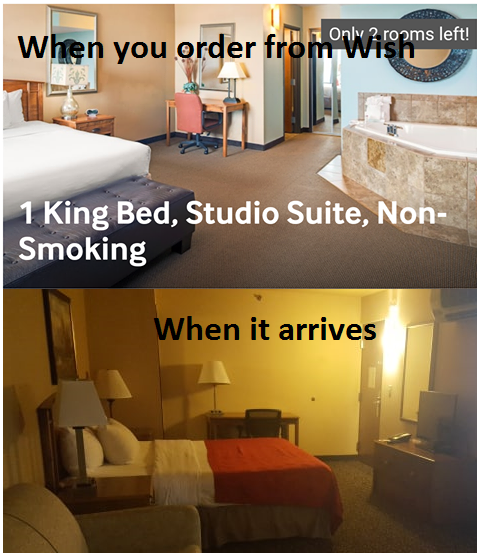
Where is `bed`? Image resolution: width=477 pixels, height=553 pixels. bed is located at coordinates (27, 154).